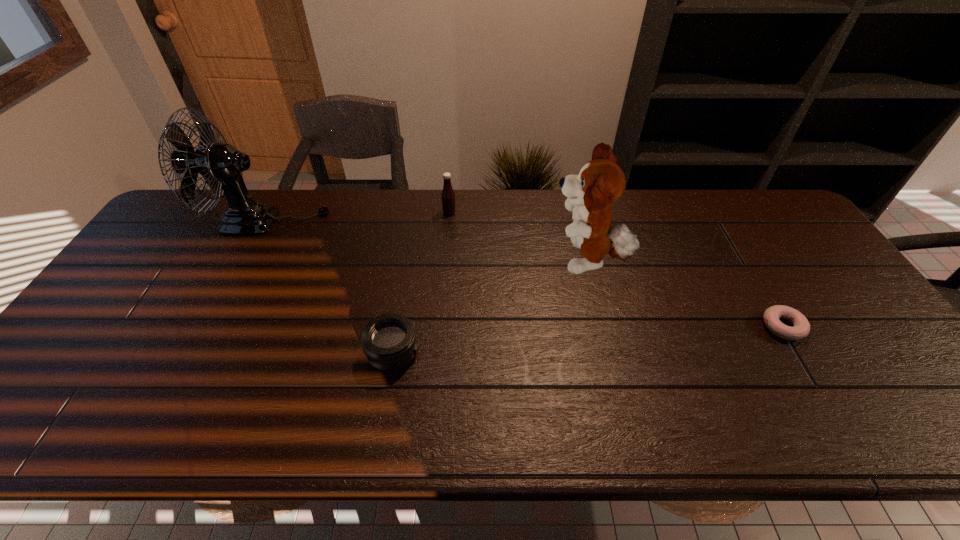
The image size is (960, 540). Find the location of `vacant point located 0.090m on the face of the fourth object from left to right`. vacant point located 0.090m on the face of the fourth object from left to right is located at coordinates (517, 262).

Where is `vacant area situated on the face of the fourth object from left to right`? The width and height of the screenshot is (960, 540). vacant area situated on the face of the fourth object from left to right is located at coordinates (442, 262).

Find the location of a particular element. This screenshot has height=540, width=960. free space located 0.220m on the right of the third object from left to right is located at coordinates (523, 213).

In order to click on vacant point located on the side of the telephoto lens with brand markings and control switches in this screenshot , I will do `click(473, 353)`.

You are a GUI agent. You are given a task and a screenshot of the screen. Output one action in this format:
    pyautogui.click(x=<x>, y=<y>)
    Task: Click on the free point located on the back of the rightmost object
    This screenshot has height=540, width=960.
    Given the screenshot: What is the action you would take?
    pyautogui.click(x=756, y=284)

Locate an element on the screen. This screenshot has height=540, width=960. fan at the far edge is located at coordinates (221, 165).

In order to click on Tabasco sauce that is at the far edge in this screenshot , I will do `click(448, 197)`.

This screenshot has height=540, width=960. I want to click on object that is at the left edge, so click(221, 165).

At what (x,y) coordinates should I click in order to perform the action: click on object at the far left corner. Please return your answer as a coordinate pair (x, y). The height and width of the screenshot is (540, 960). Looking at the image, I should click on (221, 165).

The width and height of the screenshot is (960, 540). I want to click on free space at the far edge, so click(291, 213).